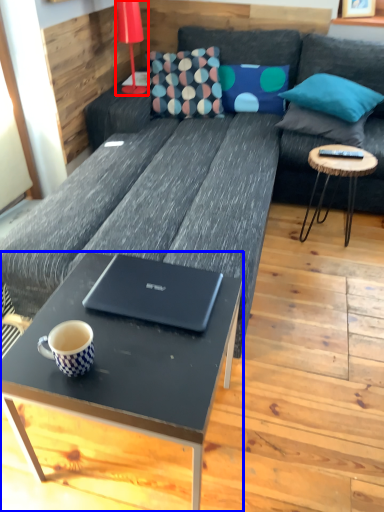
Question: Which object is closer to the camera taking this photo, lamp (highlighted by a red box) or coffee table (highlighted by a blue box)?

Choices:
 (A) lamp
 (B) coffee table

Answer: (B)